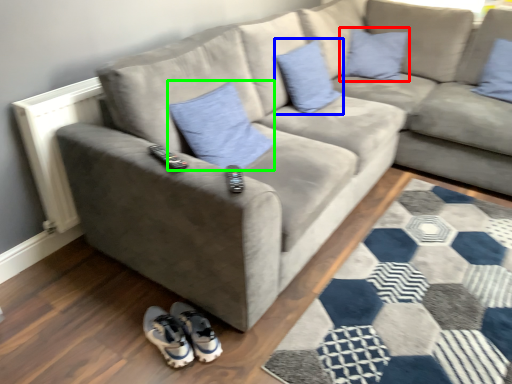
Question: Which object is positioned farthest from pillow (highlighted by a red box)? Select from pillow (highlighted by a blue box) and pillow (highlighted by a green box).

Choices:
 (A) pillow
 (B) pillow

Answer: (B)